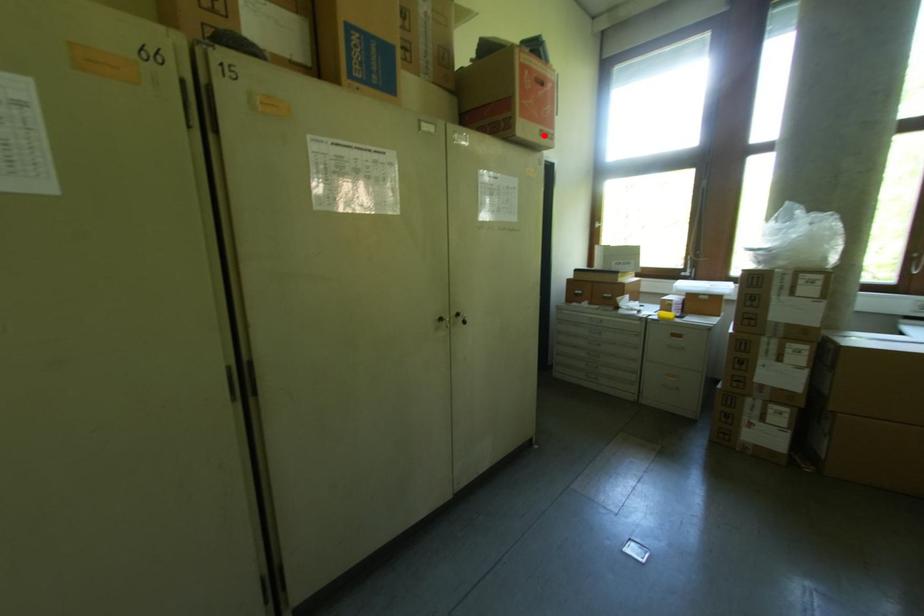
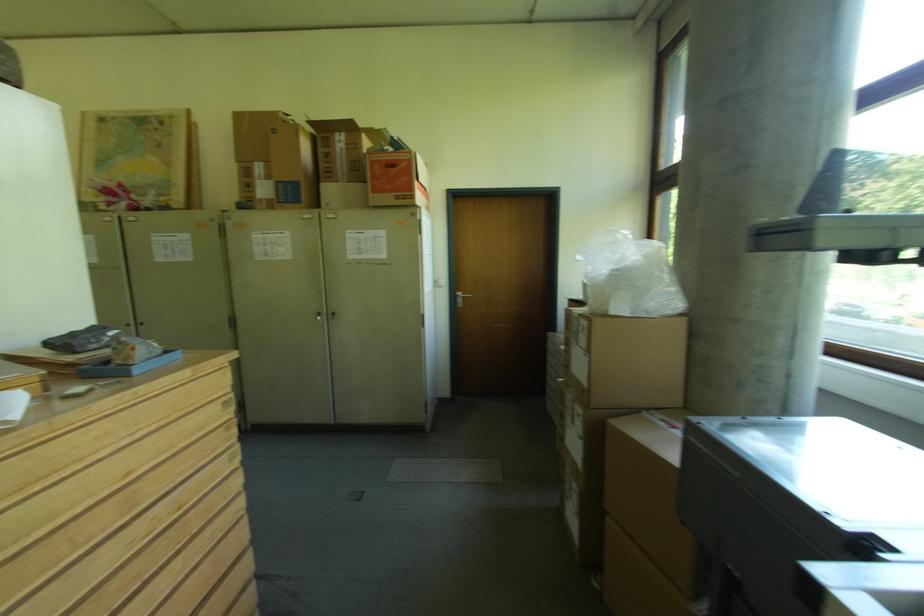
Find the pixel in the second image that matches the highlighted location in the first image.

(399, 200)